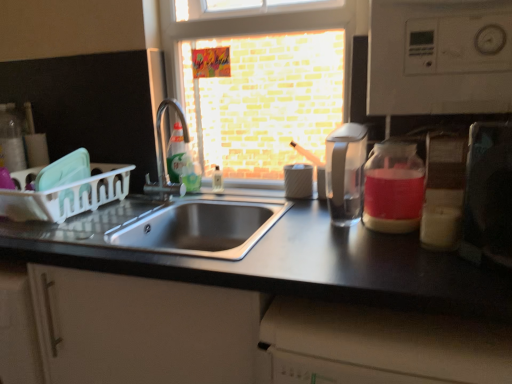
The width and height of the screenshot is (512, 384). I want to click on free space that is to the left of metallic silver toaster at right, so click(422, 269).